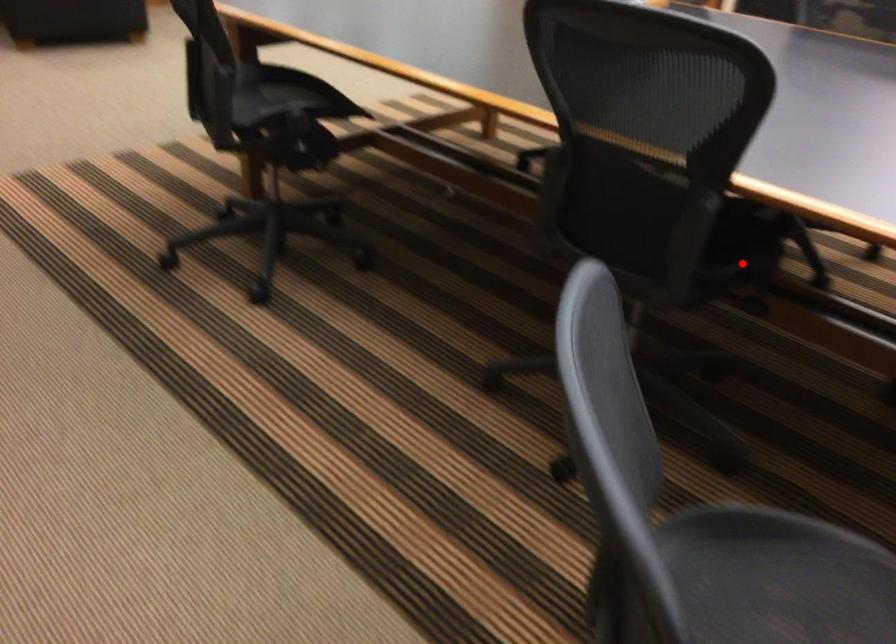
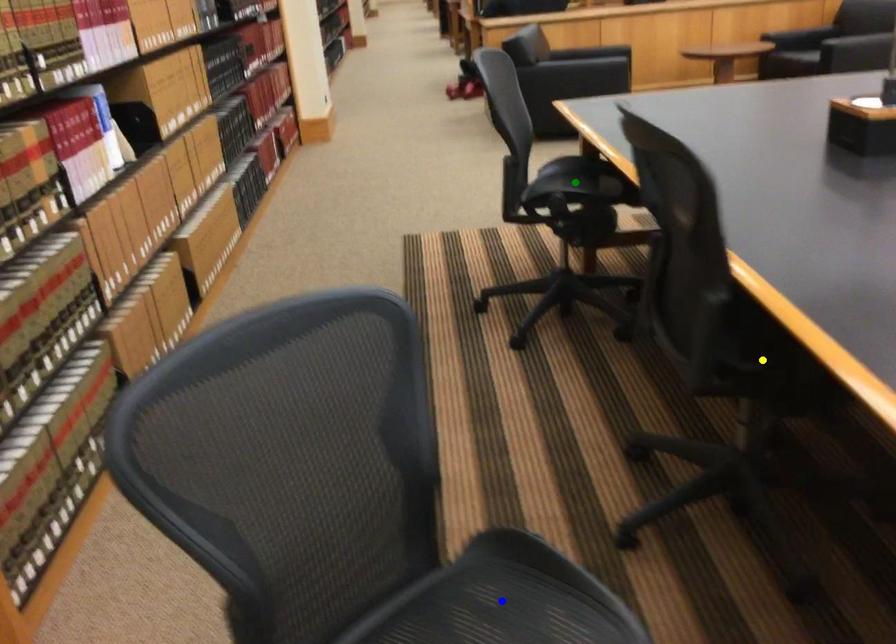
Question: I am providing you with two images of the same scene from different viewpoints. A red point is marked on the first image. You are given multiple points on the second image. Can you choose the point in image 2 that corresponds to the point in image 1?

Choices:
 (A) green point
 (B) blue point
 (C) yellow point

Answer: (C)